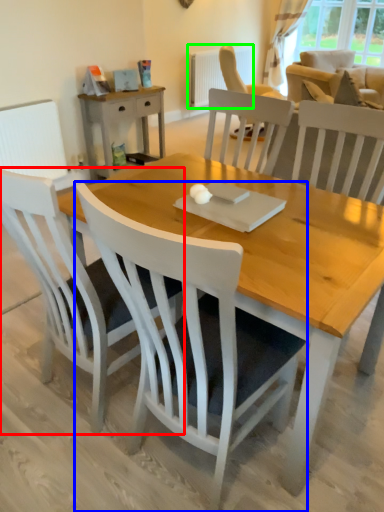
Question: Which is nearer to the chair (highlighted by a red box)? chair (highlighted by a blue box) or radiator (highlighted by a green box).

Choices:
 (A) chair
 (B) radiator

Answer: (A)